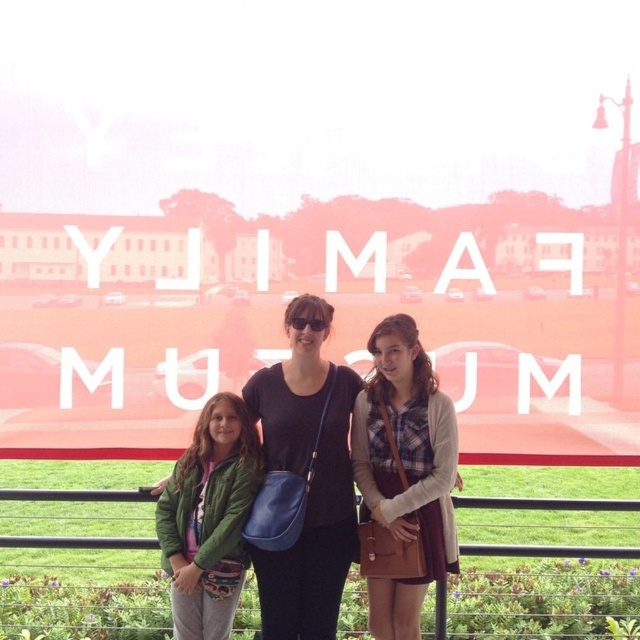
You are a photographer trying to frame a shot that includes both the plaid shirt at center and the matte black shirt at center. Which of these shirts should you focus on first if you want to ensure both are in clear focus, considering their sizes?

The plaid shirt at center is taller than the matte black shirt at center, so focusing on the plaid shirt at center first will help ensure both are in clear focus since it is larger and closer to the camera.

Based on the photo, you are a photographer adjusting the camera settings to ensure all subjects are in focus. Given that the matte black top at center is wider than the green fabric jacket at lower left, which subject should you prioritize focusing on first to account for their size difference?

The matte black top at center should be prioritized for focusing first because it is wider than the green fabric jacket at lower left, ensuring the larger subject is sharp before adjusting for the smaller one.

You are taking a photo of the YUMA FAMILY MUSEUM sign and notice two points marked in the image. The first point is at coordinate point(x=49, y=490) and the second is at point(x=344, y=385). Which point is closer to the camera?

Point(x=49, y=490) is closer to the camera than point(x=344, y=385) because it is further to the camera than the other point according to the description.